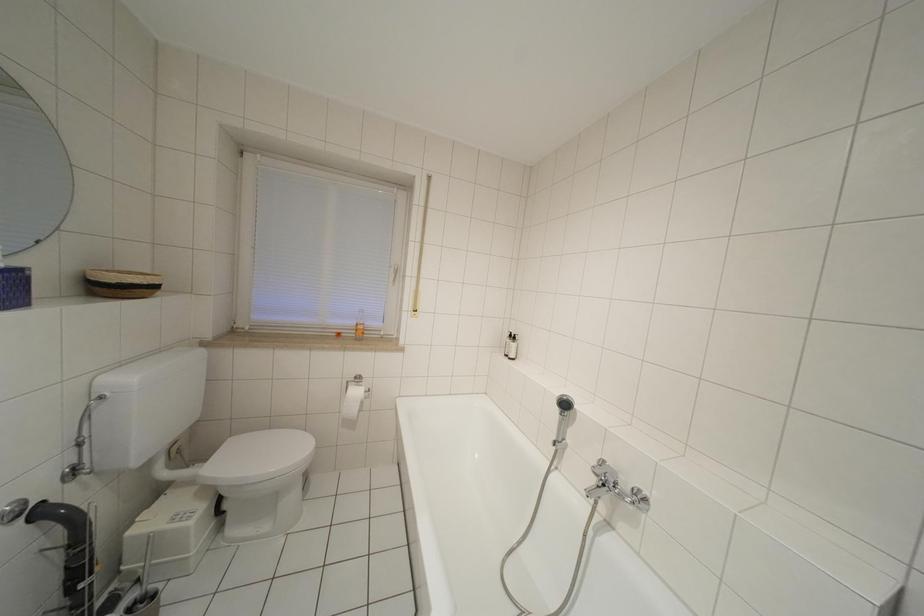
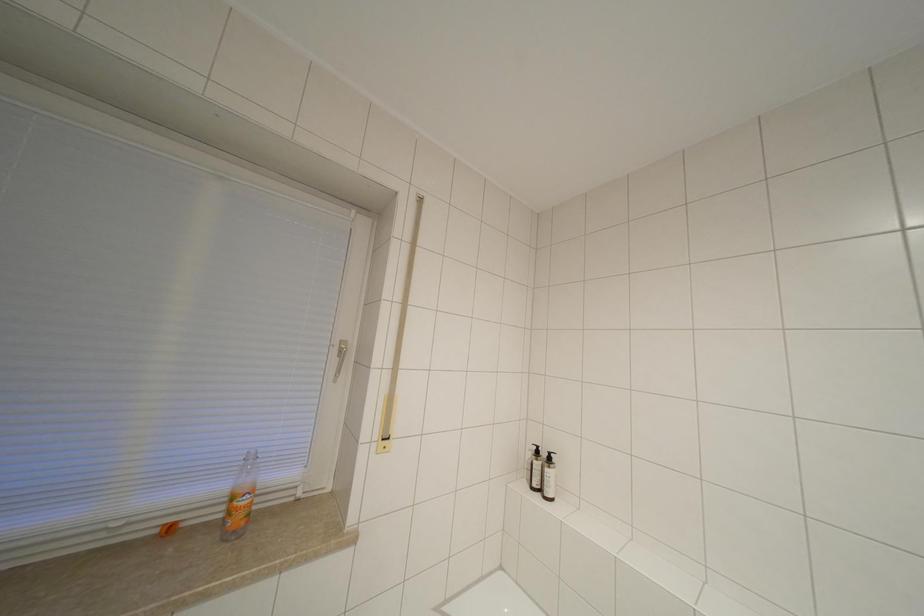
What movement of the cameraman would produce the second image?

The cameraman walked toward left, forward.